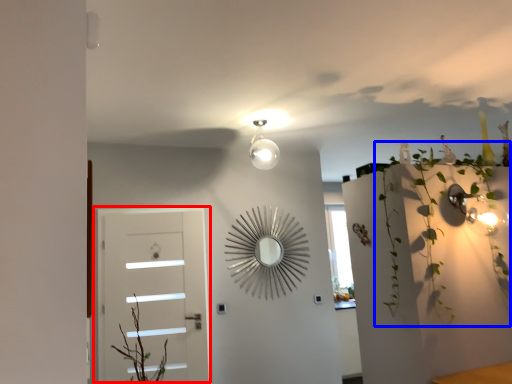
Question: Which object appears closest to the camera in this image, door (highlighted by a red box) or plant (highlighted by a blue box)?

Choices:
 (A) door
 (B) plant

Answer: (B)